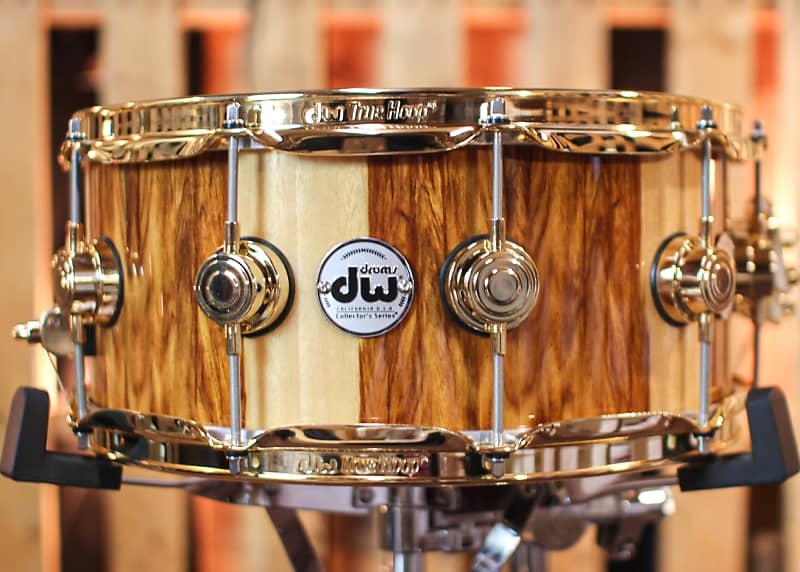
Locate an element on the screen. This screenshot has height=572, width=800. top tension rods is located at coordinates (76, 125), (237, 113), (494, 103), (700, 115), (758, 128).